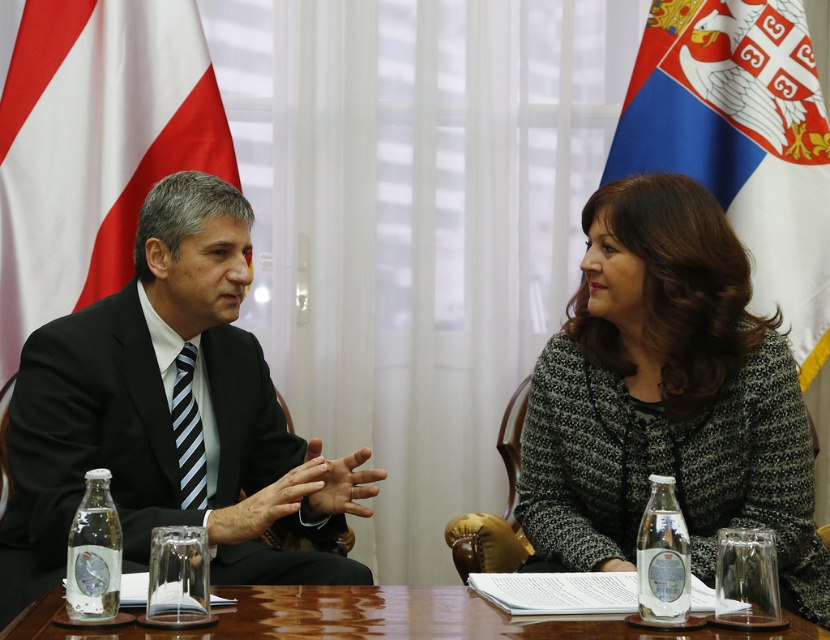
You are standing 2 meters away from the table in the meeting. There is a point at coordinates point (608, 548) on the table. Can you reach that point without moving closer to the table?

The distance of point (608, 548) from viewer is 1.80 meters. Since you are standing 2 meters away from the table, the point is closer to you than your current position. Therefore, you can reach the point without moving closer.

You are standing in the meeting room and want to hand the white fabric flag at right to someone across the room. The room has a door 3 meters away from you. Can you reach the flag without moving your feet?

The white fabric flag at right is 2.50 meters away from the viewer. Since the door is 3 meters away, which is farther than the distance to the flag, you can reach the flag without moving your feet as it is closer than the door.

You are an interior designer planning to place a 3D model of the meeting scene. The black suit at center and wooden table at center are in the way. Which object should you move to make space for the model, considering their widths?

The black suit at center has a lesser width compared to wooden table at center. Therefore, you should move the black suit at center to make space since it is narrower and easier to relocate.